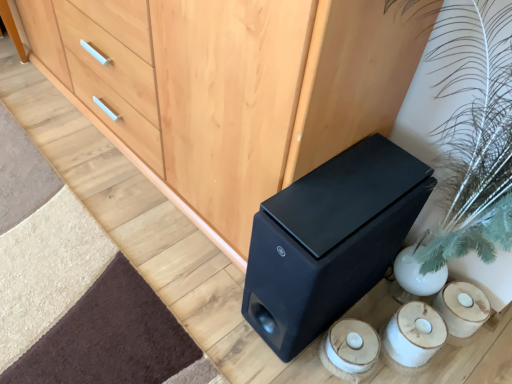
Describe the element at coordinates (329, 240) in the screenshot. The image size is (512, 384). I see `matte black speaker at lower right` at that location.

What is the approximate width of white ceramic candle holder at lower right?

white ceramic candle holder at lower right is 5.68 inches wide.

Describe the element at coordinates (350, 349) in the screenshot. Image resolution: width=512 pixels, height=384 pixels. I see `white ceramic candle holder at lower right` at that location.

Image resolution: width=512 pixels, height=384 pixels. What are the coordinates of `matte wood chest of drawers at center` in the screenshot? It's located at (234, 87).

The height and width of the screenshot is (384, 512). I want to click on matte black speaker at lower right, so click(329, 240).

Between matte black speaker at lower right and white ceramic candle holder at lower right, which one is positioned behind?

Positioned behind is white ceramic candle holder at lower right.

Is point (309, 335) farther from camera compared to point (350, 336)?

Yes.

From a real-world perspective, which is physically below, matte black speaker at lower right or white ceramic candle holder at lower right?

white ceramic candle holder at lower right.

Is matte black speaker at lower right positioned beyond the bounds of white ceramic candle holder at lower right?

Yes, matte black speaker at lower right is not within white ceramic candle holder at lower right.

Which is correct: white ceramic candle holder at lower right is inside matte wood chest of drawers at center, or outside of it?

white ceramic candle holder at lower right is outside matte wood chest of drawers at center.

Between point (344, 373) and point (281, 131), which one is positioned in front?

The point (281, 131) is more forward.

Can you confirm if white ceramic candle holder at lower right is wider than matte wood chest of drawers at center?

Incorrect, the width of white ceramic candle holder at lower right does not surpass that of matte wood chest of drawers at center.

How different are the orientations of white ceramic candle holder at lower right and matte wood chest of drawers at center in degrees?

85.6 degrees.

Between matte wood chest of drawers at center and matte black speaker at lower right, which one has larger width?

matte wood chest of drawers at center.

Between matte wood chest of drawers at center and matte black speaker at lower right, which one has more height?

matte wood chest of drawers at center is taller.

Consider the image. From the image's perspective, is matte wood chest of drawers at center on top of matte black speaker at lower right?

Indeed, from the image's perspective, matte wood chest of drawers at center is shown above matte black speaker at lower right.

From a real-world perspective, does matte wood chest of drawers at center sit lower than matte black speaker at lower right?

No, from a real-world perspective, matte wood chest of drawers at center is not beneath matte black speaker at lower right.

Is point (323, 273) closer or farther from the camera than point (281, 97)?

Clearly, point (323, 273) is more distant from the camera than point (281, 97).

Is matte black speaker at lower right wider or thinner than matte wood chest of drawers at center?

Clearly, matte black speaker at lower right has less width compared to matte wood chest of drawers at center.

How different are the orientations of matte black speaker at lower right and matte wood chest of drawers at center in degrees?

matte black speaker at lower right and matte wood chest of drawers at center are facing 1.18 degrees away from each other.

Is matte black speaker at lower right looking in the opposite direction of matte wood chest of drawers at center?

No, matte black speaker at lower right is not facing the opposite direction of matte wood chest of drawers at center.

Is matte wood chest of drawers at center oriented towards white ceramic candle holder at lower right?

No, matte wood chest of drawers at center is not aimed at white ceramic candle holder at lower right.

Considering the relative positions of matte wood chest of drawers at center and white ceramic candle holder at lower right in the image provided, is matte wood chest of drawers at center to the right of white ceramic candle holder at lower right from the viewer's perspective?

In fact, matte wood chest of drawers at center is to the left of white ceramic candle holder at lower right.

Who is bigger, matte wood chest of drawers at center or white ceramic candle holder at lower right?

matte wood chest of drawers at center.

From a real-world perspective, is matte wood chest of drawers at center positioned above or below white ceramic candle holder at lower right?

Clearly, from a real-world perspective, matte wood chest of drawers at center is above white ceramic candle holder at lower right.

In the image, there is a white ceramic candle holder at lower right. At what (x,y) coordinates should I click in order to perform the action: click on furniture above it (from the image's perspective). Please return your answer as a coordinate pair (x, y). Looking at the image, I should click on (329, 240).

From the image's perspective, which is below, white ceramic candle holder at lower right or matte black speaker at lower right?

From the image's view, white ceramic candle holder at lower right is below.

Which is correct: white ceramic candle holder at lower right is inside matte black speaker at lower right, or outside of it?

white ceramic candle holder at lower right lies outside matte black speaker at lower right.

Find the location of a particular element. The image size is (512, 384). candle holder located behind the matte black speaker at lower right is located at coordinates (350, 349).

Locate an element on the screen. The image size is (512, 384). chest of drawers on the left of white ceramic candle holder at lower right is located at coordinates (234, 87).

Estimate the real-world distances between objects in this image. Which object is closer to white ceramic candle holder at lower right, matte wood chest of drawers at center or matte black speaker at lower right?

The object closer to white ceramic candle holder at lower right is matte black speaker at lower right.

From the image, which object appears to be nearer to matte wood chest of drawers at center, matte black speaker at lower right or white ceramic candle holder at lower right?

matte black speaker at lower right is closer to matte wood chest of drawers at center.

Considering their positions, is matte wood chest of drawers at center positioned closer to matte black speaker at lower right than white ceramic candle holder at lower right?

white ceramic candle holder at lower right is closer to matte black speaker at lower right.

Which object lies further to the anchor point matte wood chest of drawers at center, white ceramic candle holder at lower right or matte black speaker at lower right?

The object further to matte wood chest of drawers at center is white ceramic candle holder at lower right.

Looking at the image, which one is located further to matte black speaker at lower right, white ceramic candle holder at lower right or matte wood chest of drawers at center?

The object further to matte black speaker at lower right is matte wood chest of drawers at center.

Consider the image. Based on their spatial positions, is matte black speaker at lower right or matte wood chest of drawers at center further from white ceramic candle holder at lower right?

matte wood chest of drawers at center is further to white ceramic candle holder at lower right.

This screenshot has height=384, width=512. In order to click on furniture between matte wood chest of drawers at center and white ceramic candle holder at lower right from top to bottom in this screenshot , I will do `click(329, 240)`.